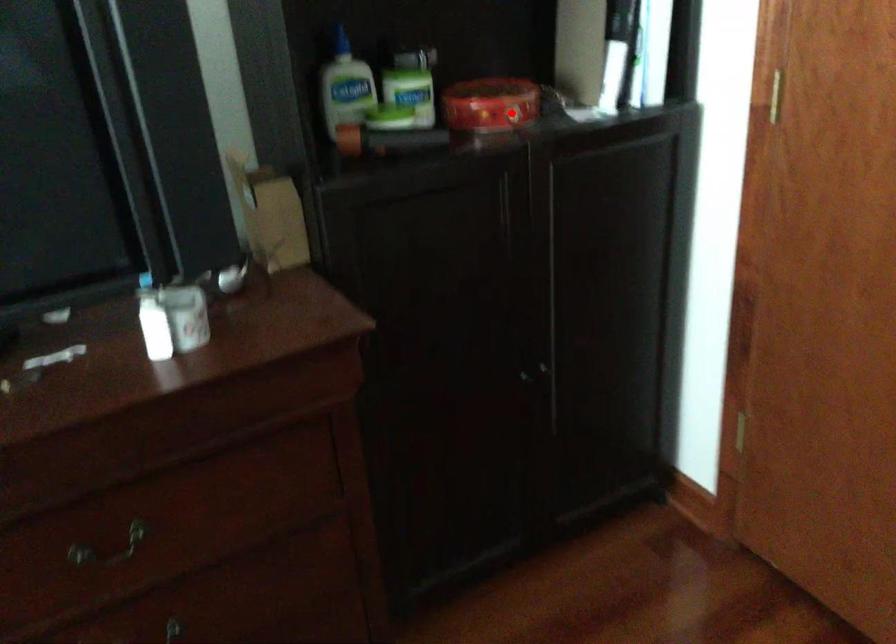
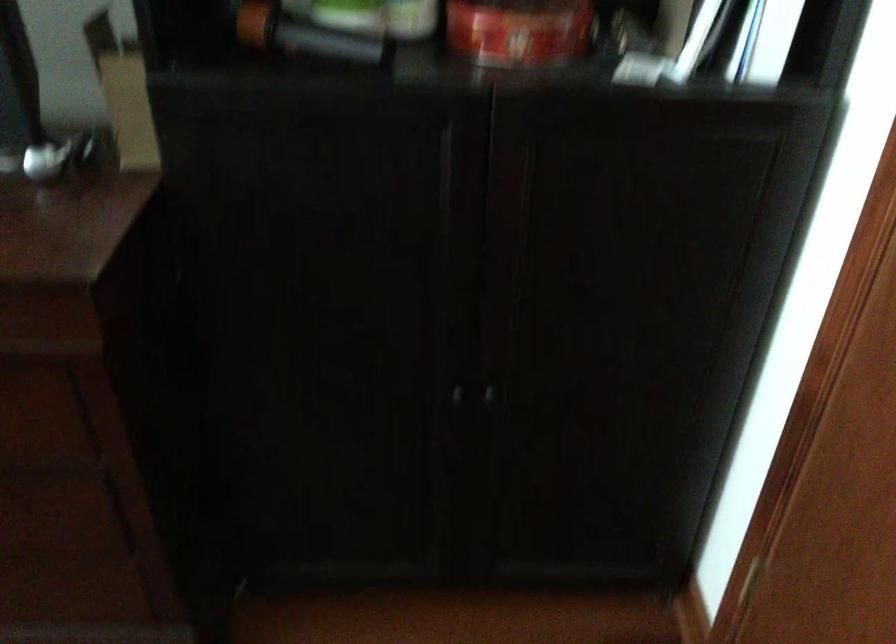
Question: I am providing you with two images of the same scene from different viewpoints. In image1, a red point is highlighted. Considering the same 3D point in image2, which of the following is correct?

Choices:
 (A) It is closer
 (B) It is farther

Answer: (A)